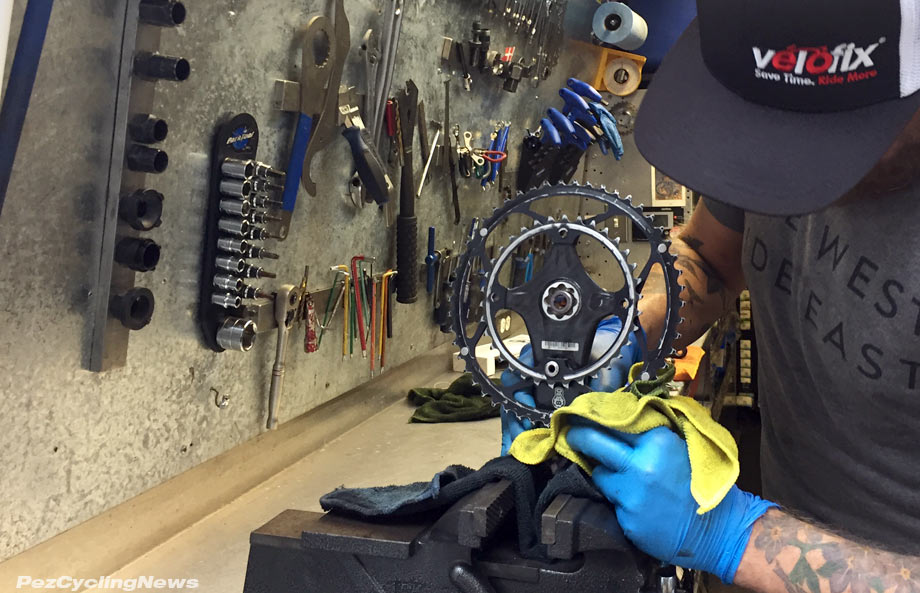
Where is `green rag`? The height and width of the screenshot is (593, 920). green rag is located at coordinates (447, 401).